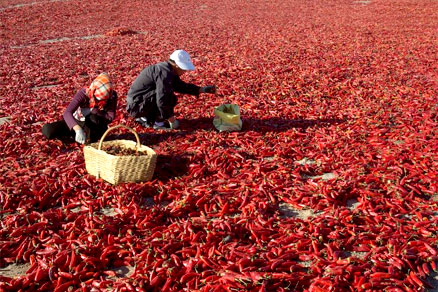
This screenshot has height=292, width=438. I want to click on wicker basket, so click(129, 162), click(101, 170).